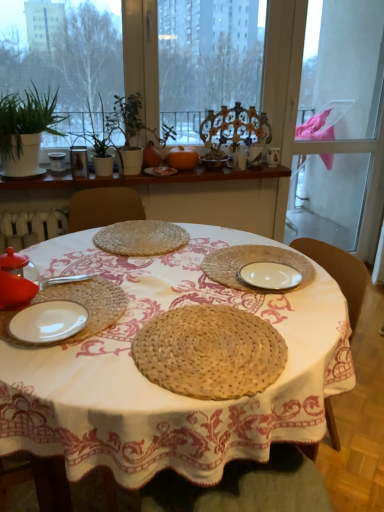
Locate an element on the screen. Image resolution: width=384 pixels, height=512 pixels. free spot above white glossy plate at lower left, which appears as the 1th plate when ordered from the bottom (from a real-world perspective) is located at coordinates (39, 322).